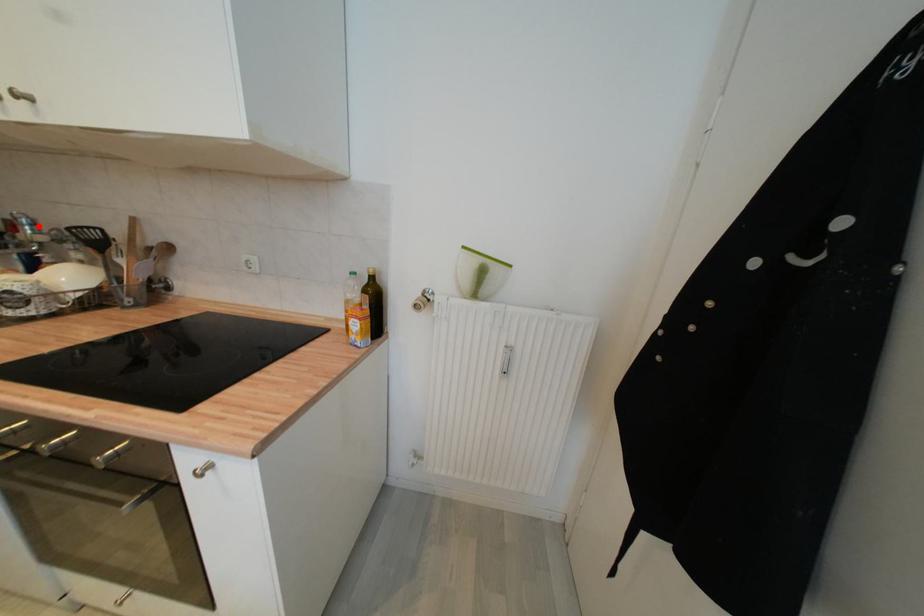
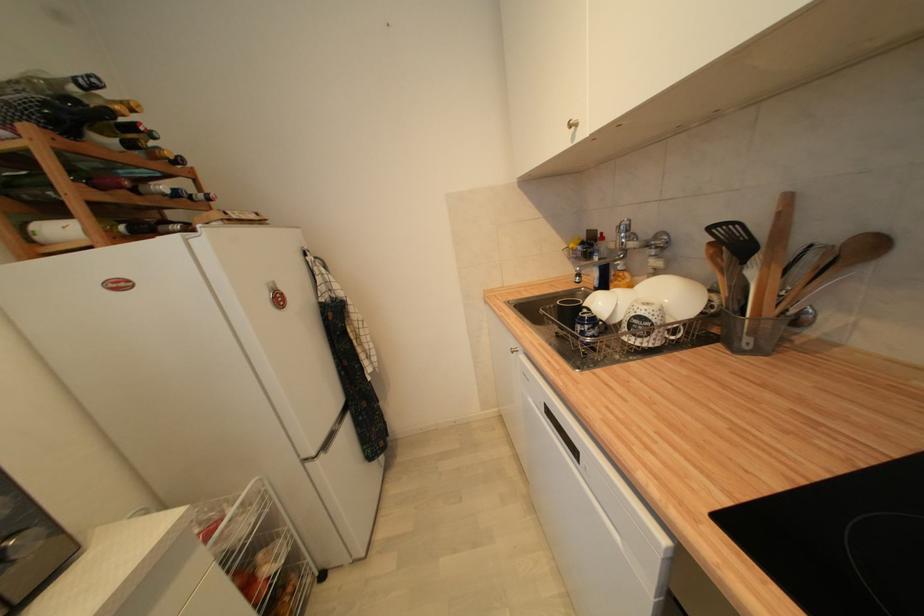
Question: I am providing you with two images of the same scene from different viewpoints. In image1, a red point is highlighted. Considering the same 3D point in image2, which of the following is correct?

Choices:
 (A) It is closer
 (B) It is farther

Answer: (A)